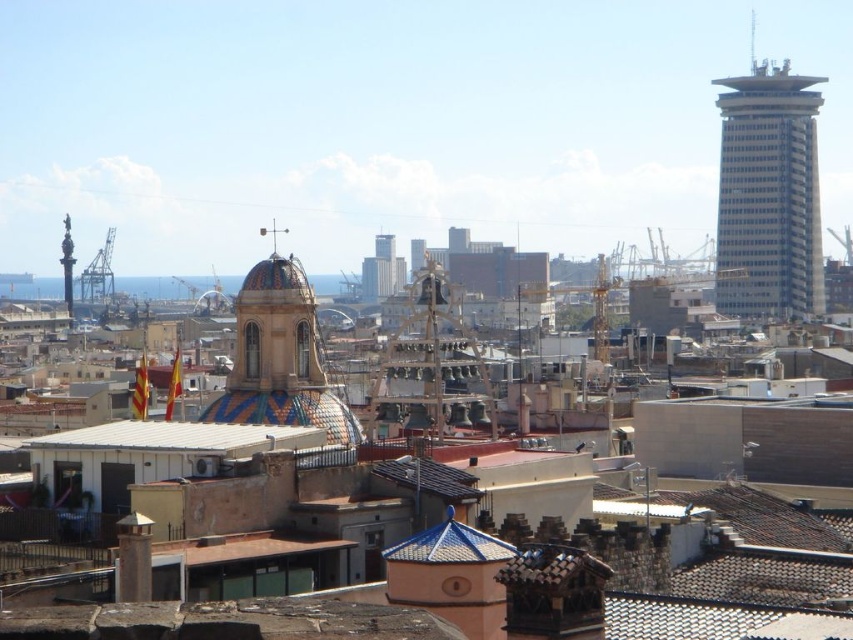
You are standing at point A located at coordinates (769, 195). You want to take a photo of the smooth glass skyscraper at right. Is the smooth glass skyscraper at right visible from your current position?

The smooth glass skyscraper at right is located at point (769, 195), so yes, it is visible from your current position.

You are an architect analyzing the cityscape. You notice the white matte roof at center and the blue glazed tiles at center. Which of these two elements is closer to your current viewpoint?

The white matte roof at center is closer to the viewer than the blue glazed tiles at center.

You are an architect planning to install a new decorative element between the white matte roof at center and the blue glazed tiles at center. Given the distance between them, can you determine if a 70 feet long decorative bridge would fit without needing to be shortened?

The distance between the white matte roof at center and the blue glazed tiles at center is 75.30 feet. A 70 feet long decorative bridge would fit as it is shorter than the required span.